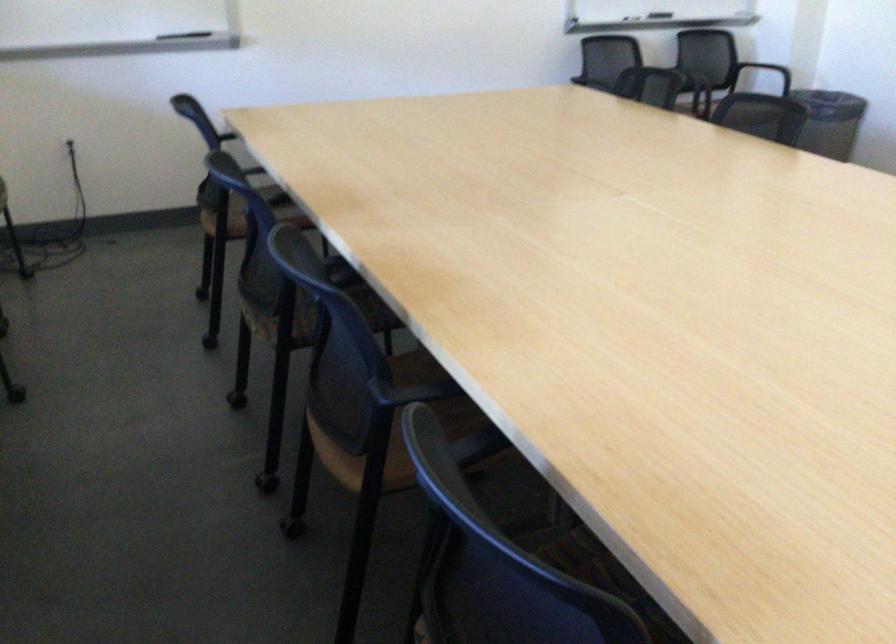
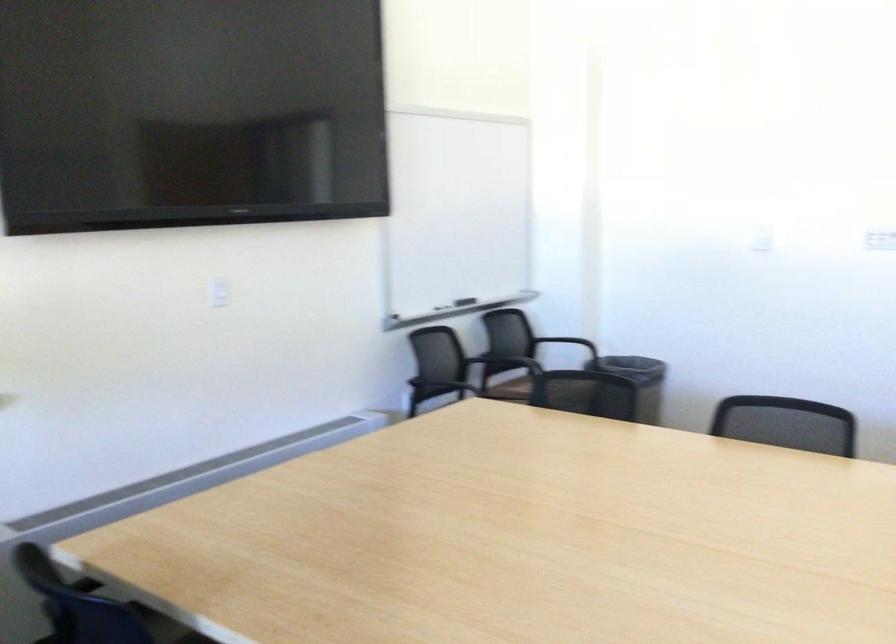
Question: I am providing you with two images of the same scene from different viewpoints. After the viewpoint changes to image2, which objects are now occluded?

Choices:
 (A) whiteboard eraser
 (B) blue cylindrical pillow
 (C) whiteboard marker
 (D) black chair sitting surface

Answer: (C)